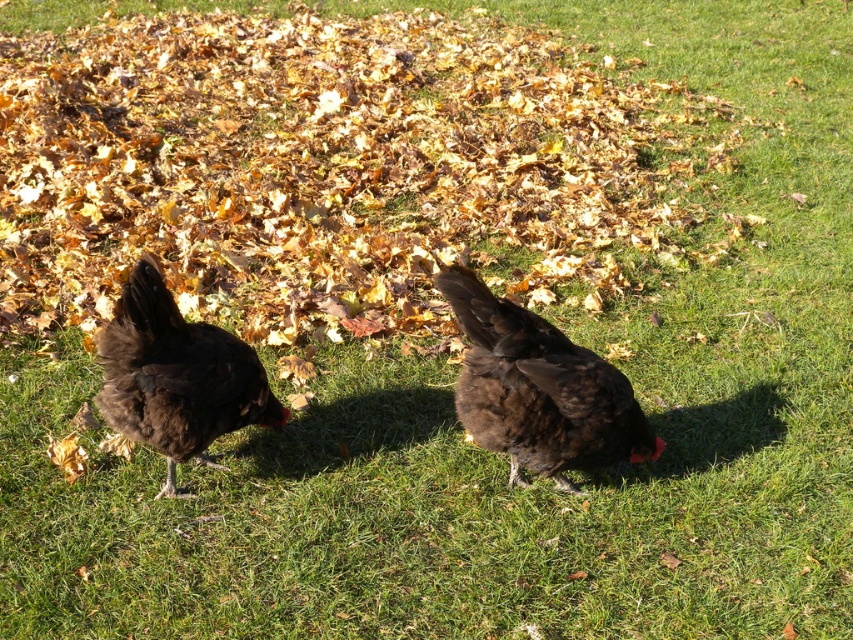
You are standing at the origin point in the image. Where is the brown fuzzy chicken at center located in terms of coordinates?

The brown fuzzy chicken at center is located at coordinates approximately 0.609 on the x axis and 0.632 on the y axis.

In the scene shown: You are standing in the grassy area and see the two chickens. Which chicken is closer to your left side, the brown fuzzy chicken at center or the brown fluffy chicken at left?

The brown fluffy chicken at left is closer to your left side because it is positioned to the left of the brown fuzzy chicken at center.

You are a photographer trying to capture both chickens in a single shot. Since the brown fluffy chicken at left is behind the brown fuzzy chicken at center, will the fluffy chicken be fully visible in the photo?

The brown fluffy chicken at left is behind the brown fuzzy chicken at center, so it may not be fully visible depending on their positions and the camera angle.